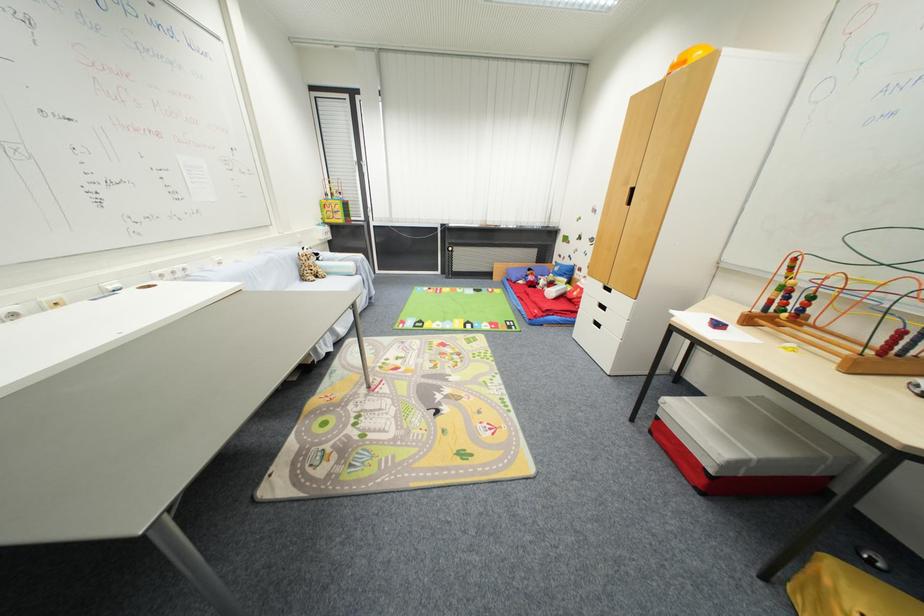
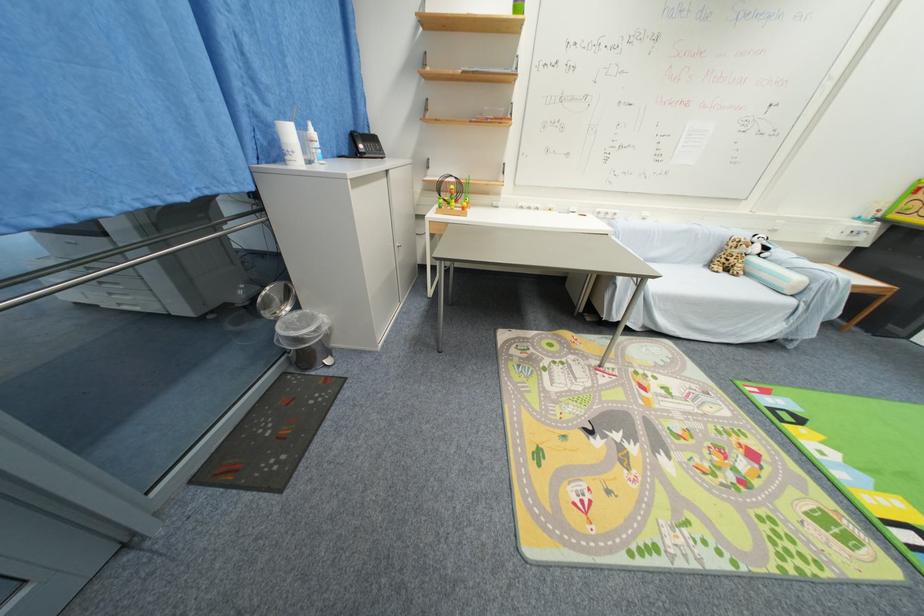
The point at (323, 282) is marked in the first image. Where is the corresponding point in the second image?

(730, 276)